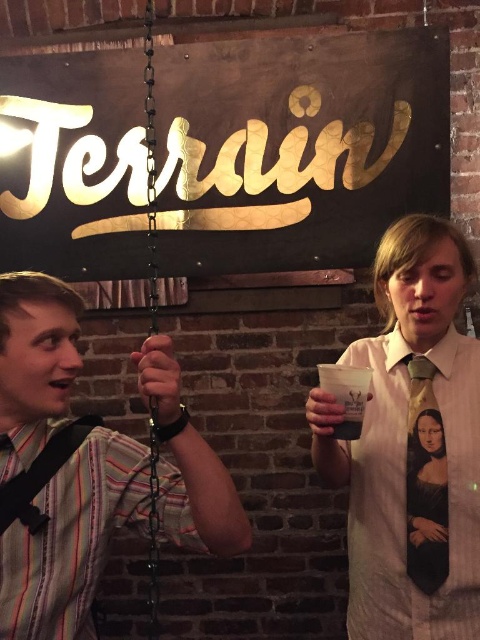
Which of these two, white silk shirt at center or monet print silk tie at center, stands taller?

white silk shirt at center

Does white silk shirt at center lie behind monet print silk tie at center?

No, it is not.

I want to click on white silk shirt at center, so click(x=411, y=445).

Which is above, monet print silk tie at center or matte plastic cup at center?

matte plastic cup at center

Does point (431, 368) lie behind point (344, 369)?

Yes, point (431, 368) is behind point (344, 369).

Who is more distant from viewer, (x=427, y=364) or (x=338, y=392)?

Positioned behind is point (x=427, y=364).

In order to click on monet print silk tie at center in this screenshot , I will do `click(424, 426)`.

Does gold metallic sign at upper center lie behind matte green tie at center?

Yes, it is.

Between point (404, 132) and point (430, 577), which one is positioned behind?

Point (404, 132)

Which is in front, point (375, 102) or point (418, 568)?

Positioned in front is point (418, 568).

What are the coordinates of `gold metallic sign at upper center` in the screenshot? It's located at (298, 147).